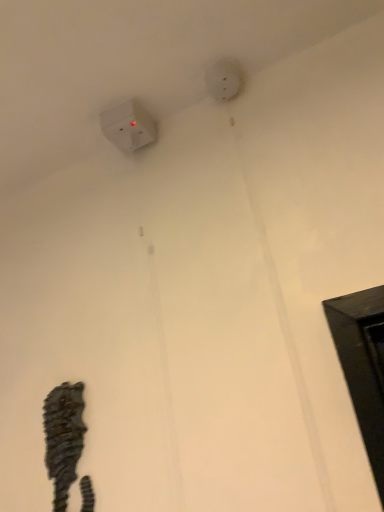
Question: From a real-world perspective, does white matte electric outlet at upper center sit lower than white plastic power plug at upper left?

Choices:
 (A) yes
 (B) no

Answer: (B)

Question: Does white matte electric outlet at upper center have a larger size compared to white plastic power plug at upper left?

Choices:
 (A) yes
 (B) no

Answer: (B)

Question: Is white matte electric outlet at upper center facing away from white plastic power plug at upper left?

Choices:
 (A) yes
 (B) no

Answer: (B)

Question: Would you say white matte electric outlet at upper center is a long distance from white plastic power plug at upper left?

Choices:
 (A) yes
 (B) no

Answer: (B)

Question: Is white matte electric outlet at upper center aimed at white plastic power plug at upper left?

Choices:
 (A) no
 (B) yes

Answer: (A)

Question: Relative to white plastic power plug at upper left, is rustic wood seahorse at lower left in front or behind?

Choices:
 (A) front
 (B) behind

Answer: (A)

Question: Is rustic wood seahorse at lower left bigger or smaller than white plastic power plug at upper left?

Choices:
 (A) big
 (B) small

Answer: (A)

Question: Which is correct: rustic wood seahorse at lower left is inside white plastic power plug at upper left, or outside of it?

Choices:
 (A) inside
 (B) outside

Answer: (B)

Question: Considering the relative positions of rustic wood seahorse at lower left and white plastic power plug at upper left in the image provided, is rustic wood seahorse at lower left to the left or to the right of white plastic power plug at upper left?

Choices:
 (A) right
 (B) left

Answer: (B)

Question: Considering their positions, is white plastic power plug at upper left located in front of or behind white matte electric outlet at upper center?

Choices:
 (A) behind
 (B) front

Answer: (A)

Question: Do you think white plastic power plug at upper left is within white matte electric outlet at upper center, or outside of it?

Choices:
 (A) outside
 (B) inside

Answer: (A)

Question: In terms of size, does white plastic power plug at upper left appear bigger or smaller than white matte electric outlet at upper center?

Choices:
 (A) big
 (B) small

Answer: (A)

Question: Considering the positions of white plastic power plug at upper left and white matte electric outlet at upper center in the image, is white plastic power plug at upper left taller or shorter than white matte electric outlet at upper center?

Choices:
 (A) tall
 (B) short

Answer: (A)

Question: Is point (56, 481) closer or farther from the camera than point (215, 74)?

Choices:
 (A) closer
 (B) farther

Answer: (A)

Question: From the image's perspective, is rustic wood seahorse at lower left positioned above or below white matte electric outlet at upper center?

Choices:
 (A) above
 (B) below

Answer: (B)